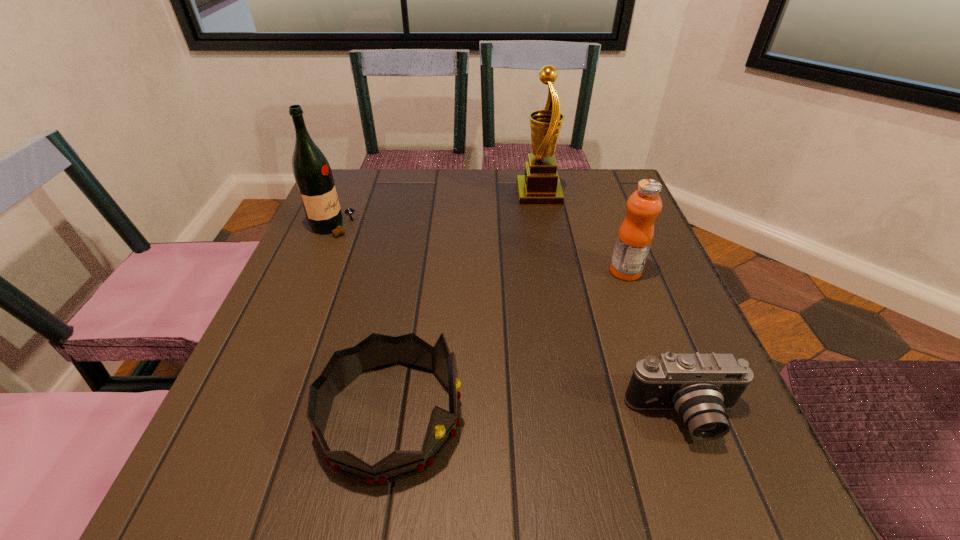
Where is `empty space between the shortest object and the third nearest object`? The height and width of the screenshot is (540, 960). empty space between the shortest object and the third nearest object is located at coordinates (655, 345).

Image resolution: width=960 pixels, height=540 pixels. Find the location of `the third closest object to the shortest object`. the third closest object to the shortest object is located at coordinates (540, 186).

Find the location of a particular element. the third closest object to the third shortest object is located at coordinates coord(376,351).

I want to click on free space that satisfies the following two spatial constraints: 1. on the back side of the third shortest object; 2. on the front-facing side of the third object from right to left, so click(597, 194).